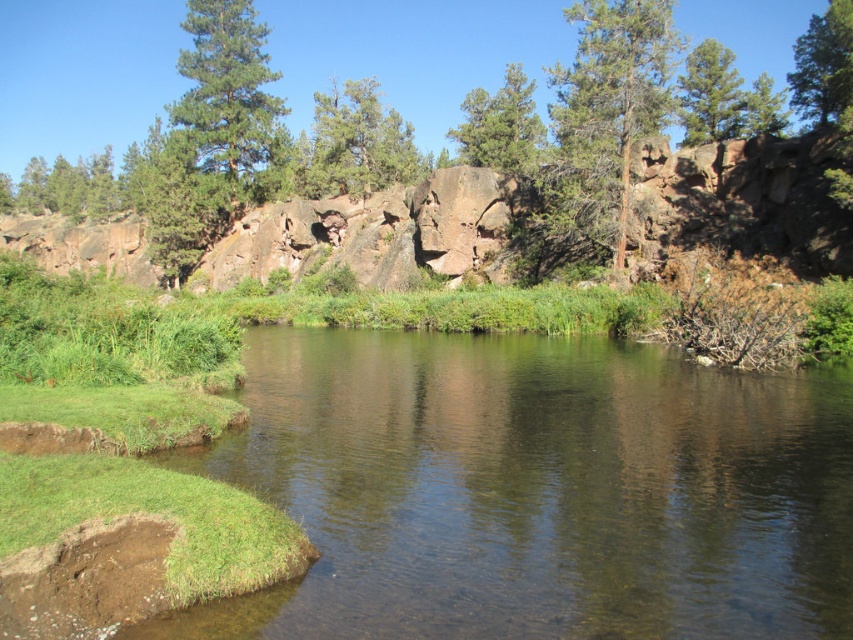
Question: Estimate the real-world distances between objects in this image. Which object is closer to the green matte tree at upper right?

Choices:
 (A) clear water at center
 (B) green textured tree at upper center

Answer: (A)

Question: Considering the relative positions of green textured tree at upper center and green matte tree at upper center in the image provided, where is green textured tree at upper center located with respect to green matte tree at upper center?

Choices:
 (A) below
 (B) above

Answer: (B)

Question: Which of these objects is positioned farthest from the green rough bark tree at upper center?

Choices:
 (A) clear water at center
 (B) green textured pine tree at upper left

Answer: (B)

Question: Which object is positioned closest to the green rough bark tree at upper center?

Choices:
 (A) clear water at center
 (B) green textured pine tree at center

Answer: (B)

Question: Where is green matte tree at upper right located in relation to green matte tree at upper center in the image?

Choices:
 (A) below
 (B) above

Answer: (B)

Question: Is the position of green rough bark tree at upper center more distant than that of green matte tree at upper right?

Choices:
 (A) no
 (B) yes

Answer: (B)